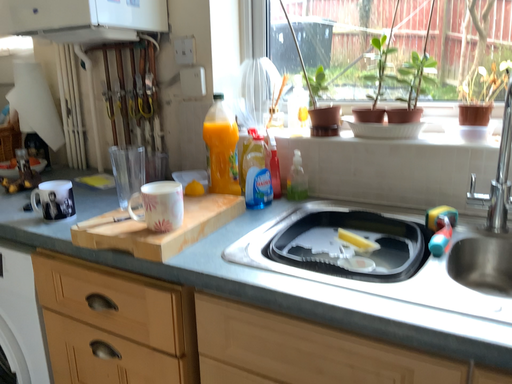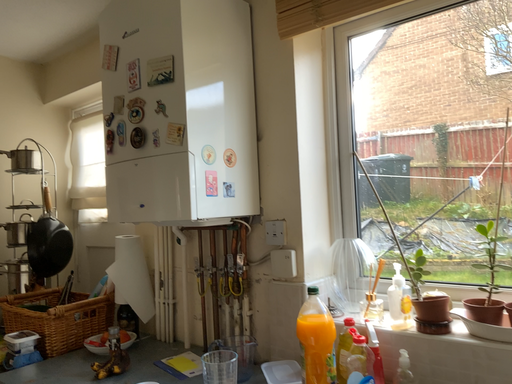
Question: Which way did the camera rotate in the video?

Choices:
 (A) rotated right
 (B) rotated left

Answer: (B)